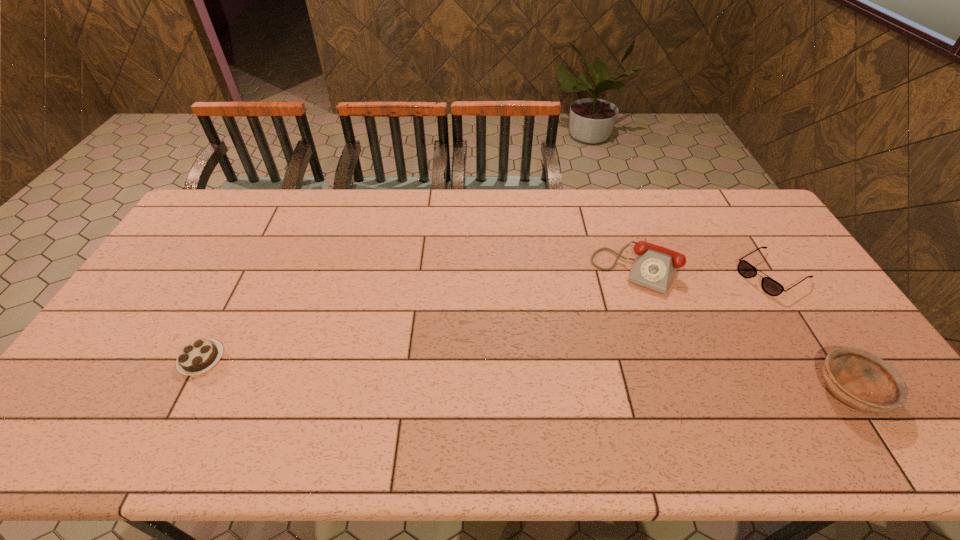
This screenshot has height=540, width=960. I want to click on free space on the desktop that is between the leftmost object and the bowl and is positioned on the dial of the third object from right to left, so click(x=588, y=377).

Find the location of `free space on the desktop that is between the shortest object and the bowl and is positioned on the front-facing side of the second shortest object`. free space on the desktop that is between the shortest object and the bowl and is positioned on the front-facing side of the second shortest object is located at coordinates (601, 378).